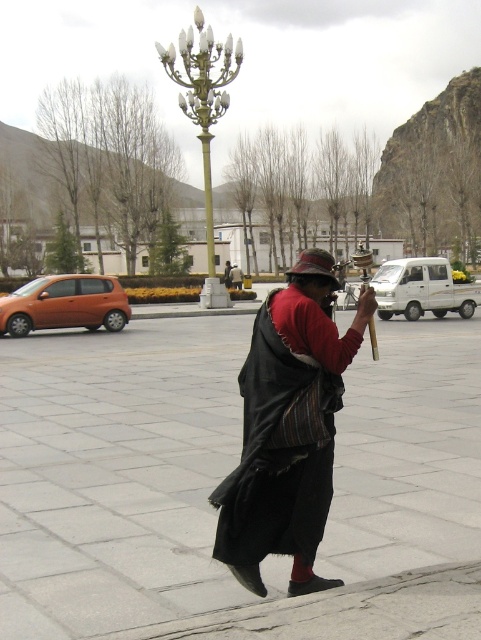
You are a photographer trying to capture the black woolen robe at center and the gold polished metal lamp post at upper center in the same frame. Based on their sizes in the image, which object would appear smaller in the photo?

The black woolen robe at center appears smaller in the photo because it is shorter than the gold polished metal lamp post at upper center.

Looking at this image, you are a photographer trying to capture the black woolen robe at center in your shot. The scene has a modern streetlamp with multiple bulbs in the background. Where should you position yourself relative to the point marked at coordinates (283, 440) to ensure the robe is centered in your photo?

To center the black woolen robe at center in your photo, you should position yourself directly at the point marked at coordinates (283, 440) since that is where the robe is located.